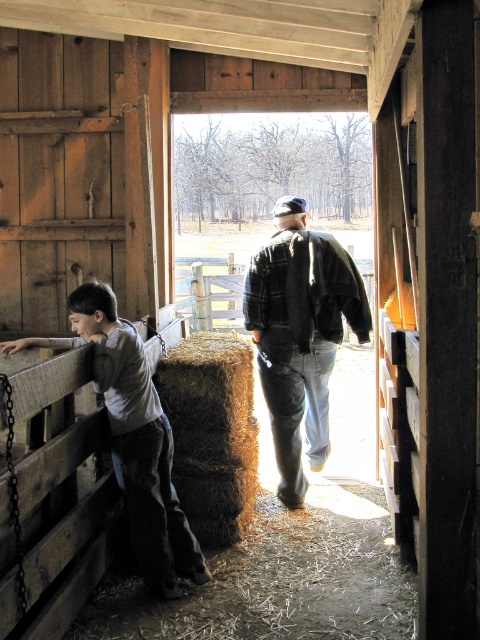
Does flannel jacket at center have a greater width compared to light brown wooden fence at left?

No.

The height and width of the screenshot is (640, 480). Identify the location of flannel jacket at center. (300, 333).

You are a GUI agent. You are given a task and a screenshot of the screen. Output one action in this format:
    pyautogui.click(x=<x>, y=<y>)
    Task: Click on the flannel jacket at center
    The image size is (480, 640).
    Given the screenshot: What is the action you would take?
    pyautogui.click(x=300, y=333)

Describe the element at coordinates (300, 333) in the screenshot. I see `flannel jacket at center` at that location.

Does flannel jacket at center have a lesser width compared to brown rough hay at center?

In fact, flannel jacket at center might be wider than brown rough hay at center.

Identify the location of flannel jacket at center. (300, 333).

The height and width of the screenshot is (640, 480). Find the location of `flannel jacket at center`. flannel jacket at center is located at coordinates (300, 333).

Who is taller, light brown wooden fence at left or brown rough hay at center?

light brown wooden fence at left is taller.

Is point (176, 596) positioned in front of point (194, 445)?

That is True.

This screenshot has width=480, height=640. In order to click on light brown wooden fence at left in this screenshot , I will do `click(133, 436)`.